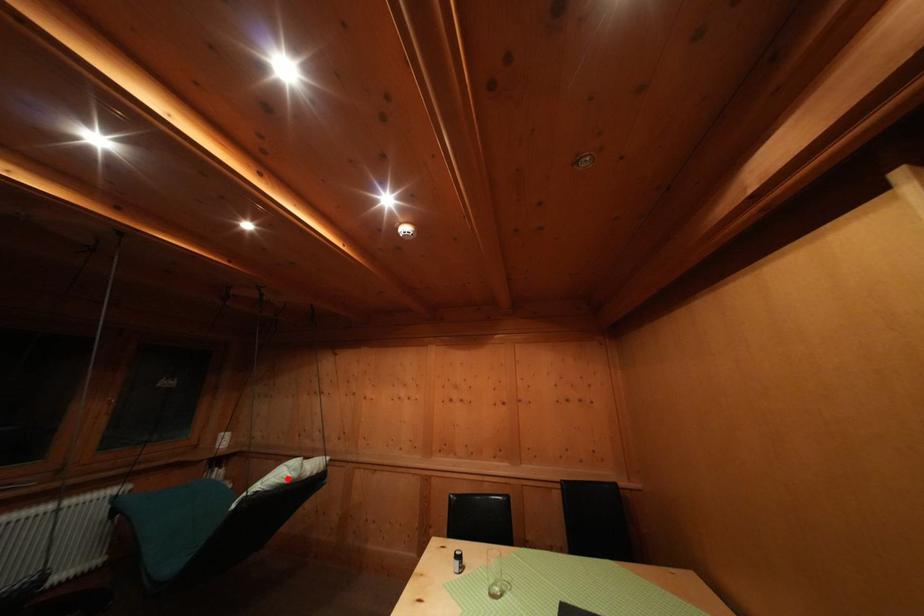
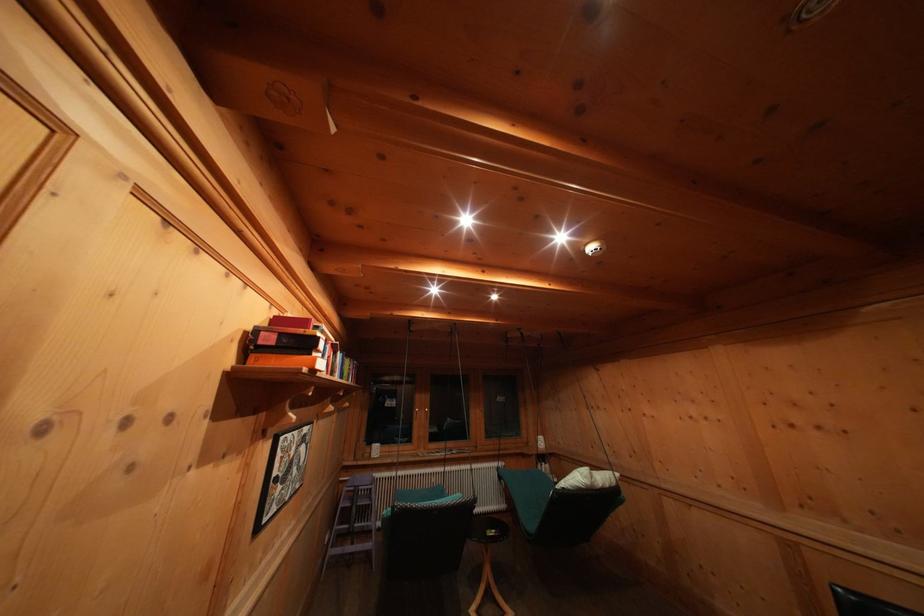
The point at the highlighted location is marked in the first image. Where is the corresponding point in the second image?

(584, 484)